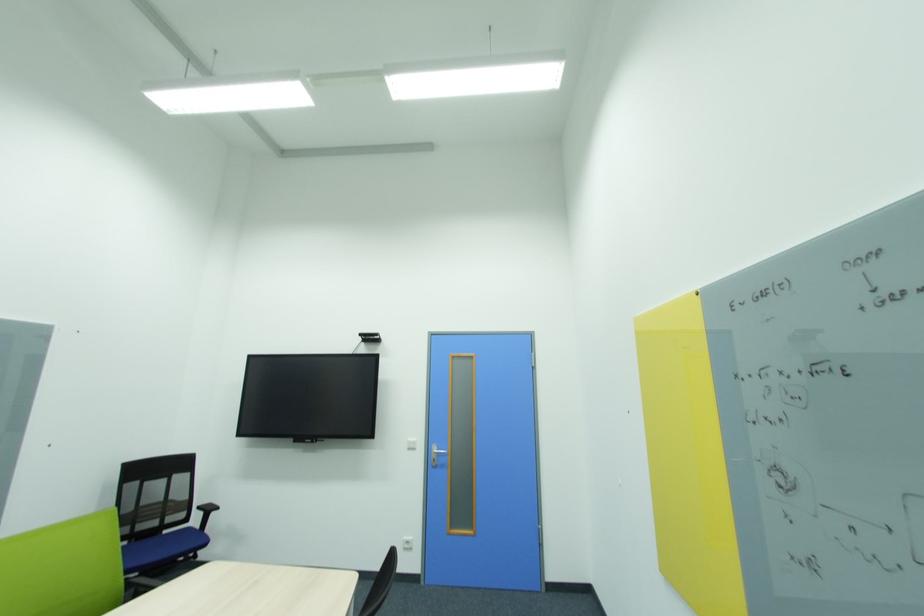
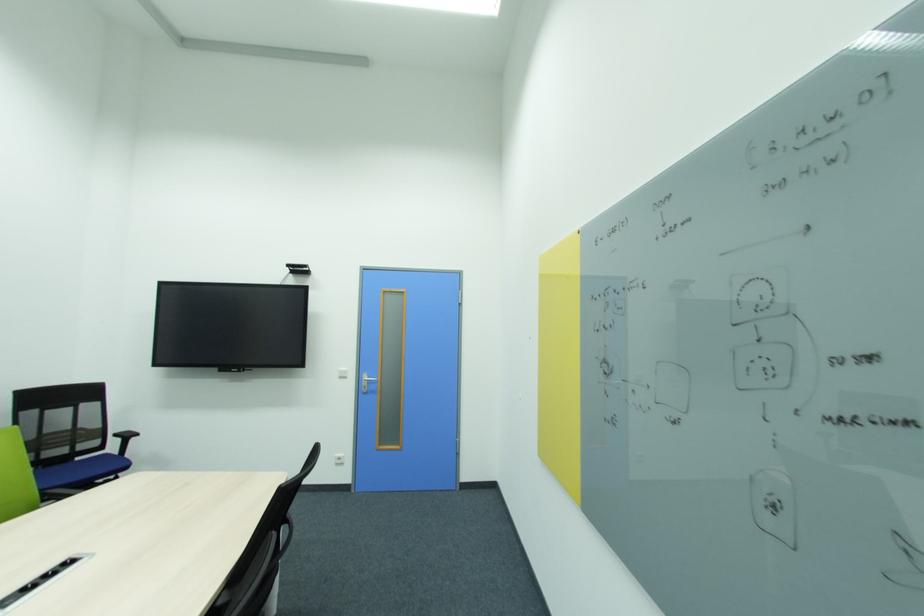
Find the pixel in the second image that matches point 439,466 in the first image.

(370, 392)